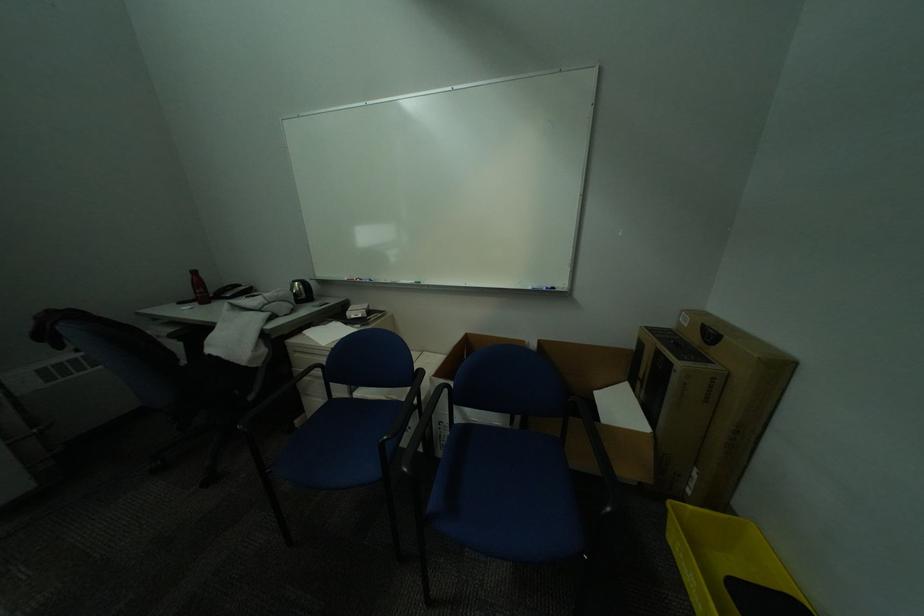
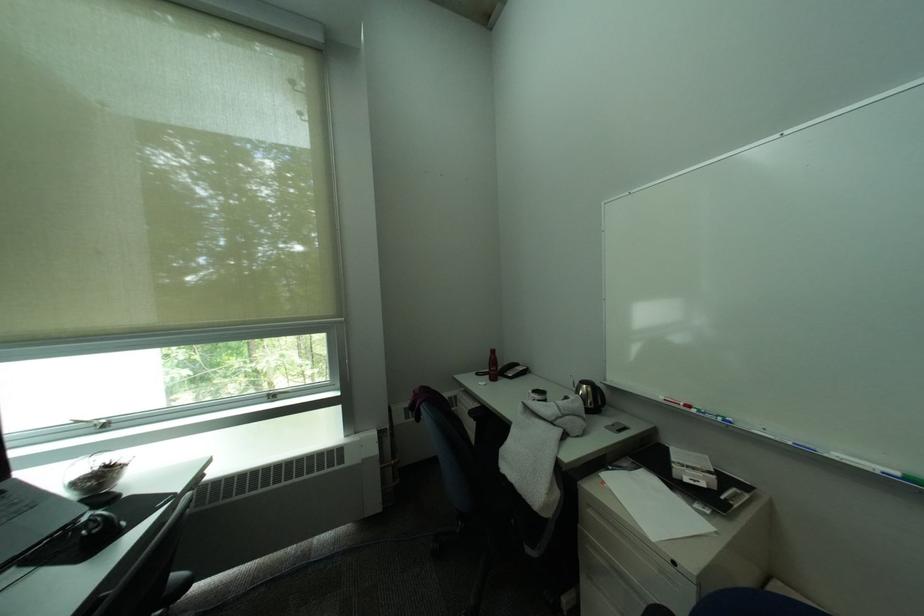
Locate, in the second image, the point that corresponds to point 374,282 in the first image.

(719, 416)